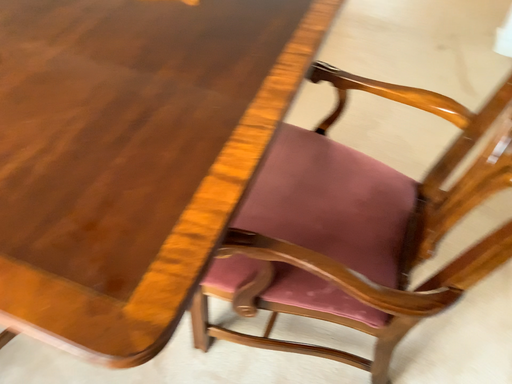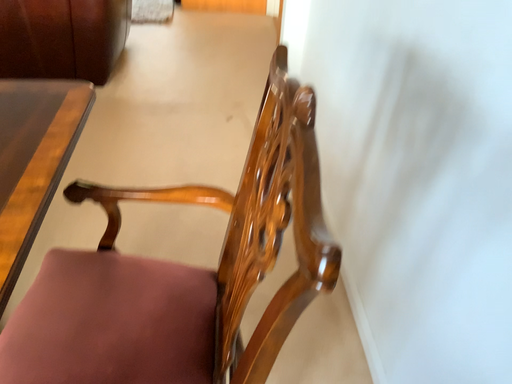
Question: How did the camera likely rotate when shooting the video?

Choices:
 (A) rotated downward
 (B) rotated upward

Answer: (B)